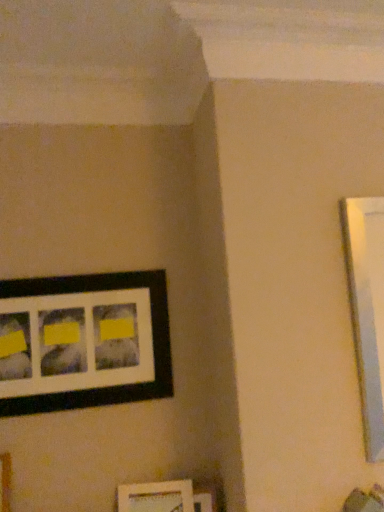
Question: From the image's perspective, is white matte picture frame at lower center, the second picture frame ordered from the bottom, located above or below matte black picture frame at lower center, which ranks as the 3th picture frame in top-to-bottom order?

Choices:
 (A) above
 (B) below

Answer: (A)

Question: Is white matte picture frame at lower center, the 2th picture frame positioned from the top, bigger or smaller than matte black picture frame at lower center, which ranks as the 3th picture frame in top-to-bottom order?

Choices:
 (A) small
 (B) big

Answer: (B)

Question: Estimate the real-world distances between objects in this image. Which object is farther from the white matte picture frame at lower center, the second picture frame ordered from the bottom?

Choices:
 (A) matte black picture frame at lower center, which ranks as the 3th picture frame in top-to-bottom order
 (B) matte black picture frame at upper left, positioned as the third picture frame in bottom-to-top order

Answer: (B)

Question: Which of these objects is positioned farthest from the matte black picture frame at upper left, which is counted as the first picture frame, starting from the top?

Choices:
 (A) white matte picture frame at lower center, the second picture frame ordered from the bottom
 (B) matte black picture frame at lower center, the first picture frame ordered from the bottom

Answer: (B)